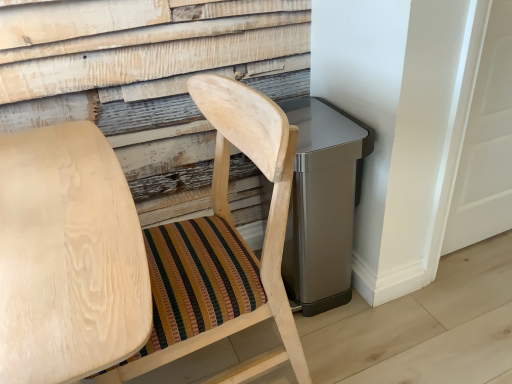
What do you see at coordinates (68, 257) in the screenshot? The height and width of the screenshot is (384, 512). I see `natural wood chair at center, which is the first chair from left to right` at bounding box center [68, 257].

I want to click on natural wood chair at center, which is counted as the second chair, starting from the right, so click(x=68, y=257).

What do you see at coordinates (139, 250) in the screenshot? The image size is (512, 384). I see `natural wood chair at center, acting as the second chair starting from the left` at bounding box center [139, 250].

Find the location of a particular element. The image size is (512, 384). natural wood chair at center, positioned as the 1th chair in right-to-left order is located at coordinates (139, 250).

Where is `natural wood chair at center, which is counted as the second chair, starting from the right`? The width and height of the screenshot is (512, 384). natural wood chair at center, which is counted as the second chair, starting from the right is located at coordinates (68, 257).

Considering the positions of objects natural wood chair at center, acting as the second chair starting from the left, and natural wood chair at center, which is the first chair from left to right, in the image provided, who is more to the right, natural wood chair at center, acting as the second chair starting from the left, or natural wood chair at center, which is the first chair from left to right,?

From the viewer's perspective, natural wood chair at center, acting as the second chair starting from the left, appears more on the right side.

Between natural wood chair at center, acting as the second chair starting from the left, and natural wood chair at center, which is the first chair from left to right, which one is positioned in front?

natural wood chair at center, which is the first chair from left to right.

Does point (45, 215) appear closer or farther from the camera than point (63, 192)?

Point (45, 215) is positioned closer to the camera compared to point (63, 192).

From the image's perspective, is natural wood chair at center, positioned as the 1th chair in right-to-left order, located above or below natural wood chair at center, which is counted as the second chair, starting from the right?

natural wood chair at center, positioned as the 1th chair in right-to-left order, is above natural wood chair at center, which is counted as the second chair, starting from the right.

From a real-world perspective, which is physically above, natural wood chair at center, positioned as the 1th chair in right-to-left order, or natural wood chair at center, which is counted as the second chair, starting from the right?

From a 3D spatial view, natural wood chair at center, positioned as the 1th chair in right-to-left order, is above.

Between natural wood chair at center, acting as the second chair starting from the left, and natural wood chair at center, which is the first chair from left to right, which one has larger width?

Wider between the two is natural wood chair at center, which is the first chair from left to right.

Considering the sizes of natural wood chair at center, positioned as the 1th chair in right-to-left order, and natural wood chair at center, which is the first chair from left to right, in the image, is natural wood chair at center, positioned as the 1th chair in right-to-left order, taller or shorter than natural wood chair at center, which is the first chair from left to right,?

natural wood chair at center, positioned as the 1th chair in right-to-left order, is taller than natural wood chair at center, which is the first chair from left to right.

Between natural wood chair at center, positioned as the 1th chair in right-to-left order, and natural wood chair at center, which is counted as the second chair, starting from the right, which one has larger size?

natural wood chair at center, which is counted as the second chair, starting from the right, is bigger.

Is natural wood chair at center, acting as the second chair starting from the left, located outside natural wood chair at center, which is counted as the second chair, starting from the right?

Absolutely, natural wood chair at center, acting as the second chair starting from the left, is external to natural wood chair at center, which is counted as the second chair, starting from the right.

Is natural wood chair at center, acting as the second chair starting from the left, not near natural wood chair at center, which is counted as the second chair, starting from the right?

No, natural wood chair at center, acting as the second chair starting from the left, is in close proximity to natural wood chair at center, which is counted as the second chair, starting from the right.

Is natural wood chair at center, positioned as the 1th chair in right-to-left order, positioned with its back to natural wood chair at center, which is the first chair from left to right?

No, natural wood chair at center, positioned as the 1th chair in right-to-left order, is not facing the opposite direction of natural wood chair at center, which is the first chair from left to right.

What's the angular difference between natural wood chair at center, acting as the second chair starting from the left, and natural wood chair at center, which is the first chair from left to right,'s facing directions?

They differ by 91 degrees in their facing directions.

Identify the location of chair that is above the natural wood chair at center, which is counted as the second chair, starting from the right (from a real-world perspective). (139, 250).

Which object is positioned more to the right, natural wood chair at center, which is the first chair from left to right, or natural wood chair at center, acting as the second chair starting from the left?

natural wood chair at center, acting as the second chair starting from the left.

Which object is further away from the camera taking this photo, natural wood chair at center, which is counted as the second chair, starting from the right, or natural wood chair at center, positioned as the 1th chair in right-to-left order?

natural wood chair at center, positioned as the 1th chair in right-to-left order, is behind.

Does point (11, 260) come in front of point (9, 362)?

No, it is not.

From the image's perspective, which one is positioned higher, natural wood chair at center, which is counted as the second chair, starting from the right, or natural wood chair at center, positioned as the 1th chair in right-to-left order?

natural wood chair at center, positioned as the 1th chair in right-to-left order, from the image's perspective.

From a real-world perspective, is natural wood chair at center, which is the first chair from left to right, positioned over natural wood chair at center, positioned as the 1th chair in right-to-left order, based on gravity?

No, from a real-world perspective, natural wood chair at center, which is the first chair from left to right, is not on top of natural wood chair at center, positioned as the 1th chair in right-to-left order.

Considering the sizes of natural wood chair at center, which is counted as the second chair, starting from the right, and natural wood chair at center, acting as the second chair starting from the left, in the image, is natural wood chair at center, which is counted as the second chair, starting from the right, wider or thinner than natural wood chair at center, acting as the second chair starting from the left,?

Clearly, natural wood chair at center, which is counted as the second chair, starting from the right, has more width compared to natural wood chair at center, acting as the second chair starting from the left.

Considering the sizes of objects natural wood chair at center, which is counted as the second chair, starting from the right, and natural wood chair at center, acting as the second chair starting from the left, in the image provided, who is shorter, natural wood chair at center, which is counted as the second chair, starting from the right, or natural wood chair at center, acting as the second chair starting from the left,?

natural wood chair at center, which is counted as the second chair, starting from the right.

Looking at the image, does natural wood chair at center, which is the first chair from left to right, seem bigger or smaller compared to natural wood chair at center, acting as the second chair starting from the left?

Considering their sizes, natural wood chair at center, which is the first chair from left to right, takes up more space than natural wood chair at center, acting as the second chair starting from the left.

Is natural wood chair at center, which is counted as the second chair, starting from the right, located outside natural wood chair at center, acting as the second chair starting from the left?

Yes.

Is natural wood chair at center, which is counted as the second chair, starting from the right, looking in the opposite direction of natural wood chair at center, positioned as the 1th chair in right-to-left order?

No, natural wood chair at center, which is counted as the second chair, starting from the right,'s orientation is not away from natural wood chair at center, positioned as the 1th chair in right-to-left order.

Could you measure the distance between natural wood chair at center, which is counted as the second chair, starting from the right, and natural wood chair at center, acting as the second chair starting from the left?

natural wood chair at center, which is counted as the second chair, starting from the right, is 13.29 inches away from natural wood chair at center, acting as the second chair starting from the left.

I want to click on chair on the left of natural wood chair at center, acting as the second chair starting from the left, so coord(68,257).

The width and height of the screenshot is (512, 384). I want to click on chair beneath the natural wood chair at center, positioned as the 1th chair in right-to-left order (from a real-world perspective), so click(x=68, y=257).

Locate an element on the screen. This screenshot has width=512, height=384. chair lying on the left of natural wood chair at center, positioned as the 1th chair in right-to-left order is located at coordinates (68, 257).